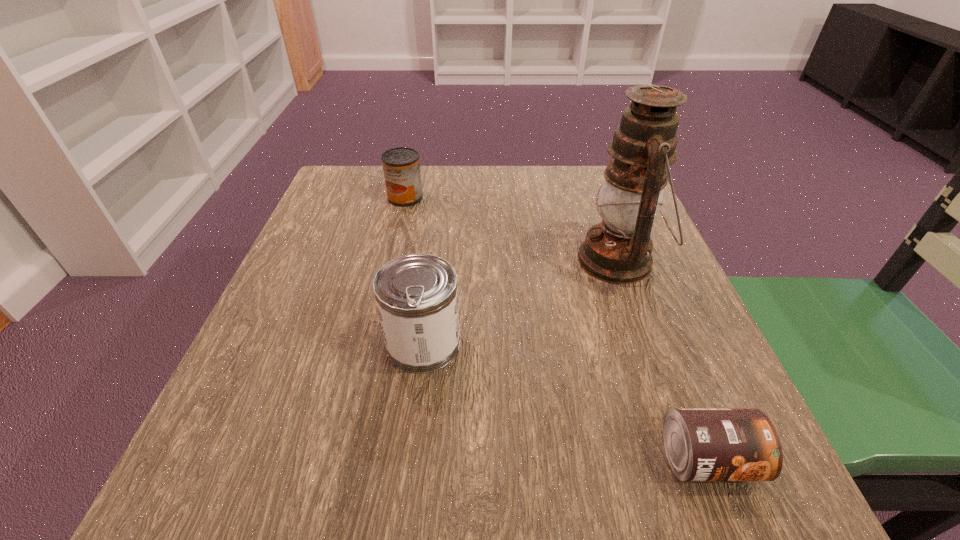
Identify the location of free spot between the farthest can and the shortest can. Image resolution: width=960 pixels, height=540 pixels. (556, 328).

At what (x,y) coordinates should I click in order to perform the action: click on vacant area between the second tallest can and the lantern. Please return your answer as a coordinate pair (x, y). This screenshot has height=540, width=960. Looking at the image, I should click on (512, 228).

Locate an element on the screen. The image size is (960, 540). empty space between the second nearest object and the lantern is located at coordinates (521, 301).

Identify which object is the third closest to the farthest can. Please provide its 2D coordinates. Your answer should be formatted as a tuple, i.e. [(x, y)], where the tuple contains the x and y coordinates of a point satisfying the conditions above.

[(702, 444)]

Identify which object is the closest to the tallest object. Please provide its 2D coordinates. Your answer should be formatted as a tuple, i.e. [(x, y)], where the tuple contains the x and y coordinates of a point satisfying the conditions above.

[(416, 294)]

Find the location of `can that is the closest to the farthest object`. can that is the closest to the farthest object is located at coordinates (416, 294).

Locate an element on the screen. This screenshot has width=960, height=540. can that is the closest to the second tallest object is located at coordinates (702, 444).

I want to click on vacant space that satisfies the following two spatial constraints: 1. on the front side of the tallest object; 2. on the right side of the second shortest object, so click(x=391, y=260).

This screenshot has height=540, width=960. Identify the location of free space in the image that satisfies the following two spatial constraints: 1. on the front side of the second tallest can; 2. on the right side of the tallest object. (391, 260).